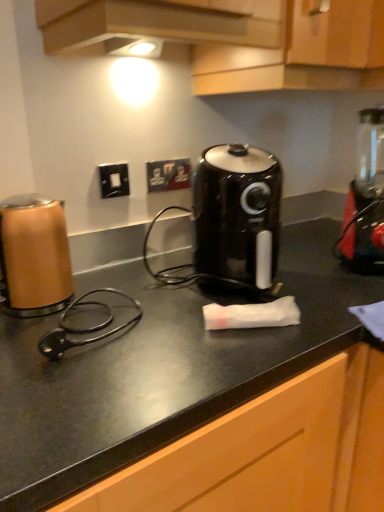
The height and width of the screenshot is (512, 384). Find the location of `space that is in front of copper metallic kettle at left`. space that is in front of copper metallic kettle at left is located at coordinates (47, 356).